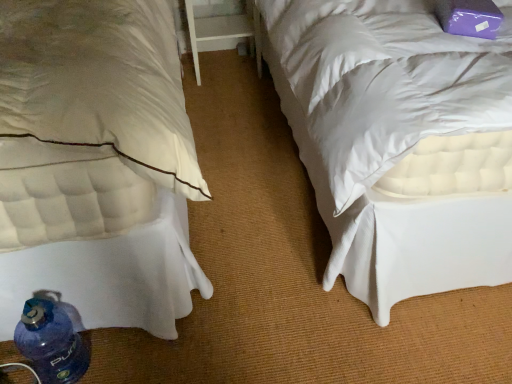
Question: Should I look upward or downward to see white quilted mattress at lower left?

Choices:
 (A) up
 (B) down

Answer: (A)

Question: Is blue plastic bottle at lower left positioned with its back to white quilted mattress at lower left?

Choices:
 (A) no
 (B) yes

Answer: (B)

Question: Considering the relative positions of blue plastic bottle at lower left and white quilted mattress at lower left in the image provided, is blue plastic bottle at lower left in front of white quilted mattress at lower left?

Choices:
 (A) no
 (B) yes

Answer: (A)

Question: From the image's perspective, is blue plastic bottle at lower left on top of white quilted mattress at lower left?

Choices:
 (A) no
 (B) yes

Answer: (A)

Question: Considering the relative sizes of blue plastic bottle at lower left and white quilted mattress at lower left in the image provided, is blue plastic bottle at lower left taller than white quilted mattress at lower left?

Choices:
 (A) yes
 (B) no

Answer: (B)

Question: Does blue plastic bottle at lower left have a larger size compared to white quilted mattress at lower left?

Choices:
 (A) yes
 (B) no

Answer: (B)

Question: Can you confirm if blue plastic bottle at lower left is thinner than white quilted mattress at lower left?

Choices:
 (A) yes
 (B) no

Answer: (A)

Question: Would you consider white wood table at center to be distant from white quilted mattress at lower left?

Choices:
 (A) no
 (B) yes

Answer: (B)

Question: Is white wood table at center looking in the opposite direction of white quilted mattress at lower left?

Choices:
 (A) yes
 (B) no

Answer: (B)

Question: Can you confirm if white wood table at center is shorter than white quilted mattress at lower left?

Choices:
 (A) no
 (B) yes

Answer: (B)

Question: Considering the relative sizes of white wood table at center and white quilted mattress at lower left in the image provided, is white wood table at center taller than white quilted mattress at lower left?

Choices:
 (A) no
 (B) yes

Answer: (A)

Question: Would you say white quilted mattress at lower left is part of white wood table at center's contents?

Choices:
 (A) yes
 (B) no

Answer: (B)

Question: Is white wood table at center closer to camera compared to white quilted mattress at lower left?

Choices:
 (A) no
 (B) yes

Answer: (A)

Question: Considering the relative positions of white quilted mattress at lower left and white wood table at center in the image provided, is white quilted mattress at lower left in front of white wood table at center?

Choices:
 (A) yes
 (B) no

Answer: (A)